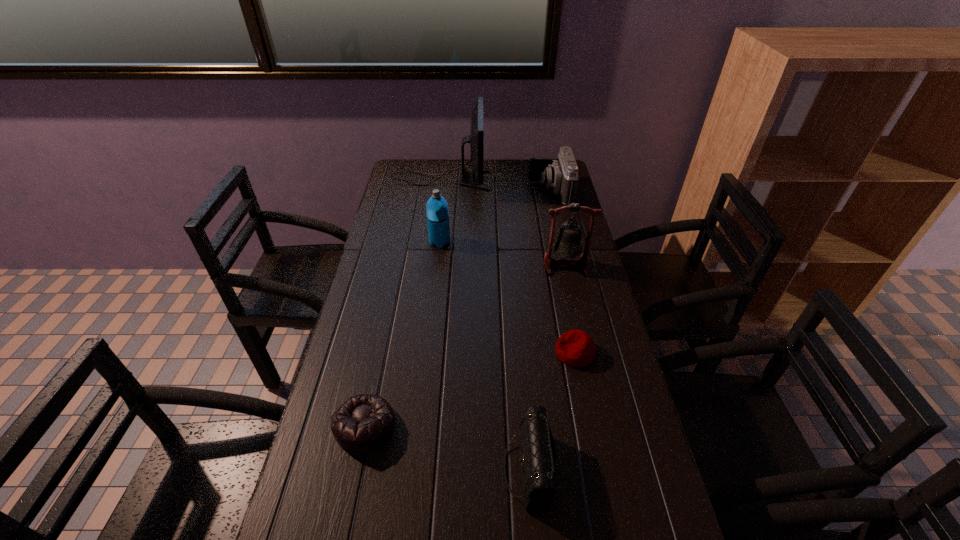
At what (x,y) coordinates should I click in order to perform the action: click on free location located on the screen side of the tallest object. Please return your answer as a coordinate pair (x, y). Looking at the image, I should click on (533, 180).

Where is `vacant area situated on the back of the fourth farthest object`? vacant area situated on the back of the fourth farthest object is located at coordinates (557, 227).

Image resolution: width=960 pixels, height=540 pixels. Find the location of `free location located on the left of the fifth nearest object`. free location located on the left of the fifth nearest object is located at coordinates (x=403, y=242).

Identify the location of free space located 0.170m at the front of the fourth shortest object with an open lens cover. (487, 191).

At what (x,y) coordinates should I click in order to perform the action: click on free space located 0.120m at the front of the fourth shortest object with an open lens cover. Please return your answer as a coordinate pair (x, y). The image size is (960, 540). Looking at the image, I should click on [499, 191].

Find the location of a particular element. This screenshot has width=960, height=540. free location located at the front of the fourth shortest object with an open lens cover is located at coordinates (472, 191).

The image size is (960, 540). Find the location of `vacant space located on the front flap of the fourth object from right to left`. vacant space located on the front flap of the fourth object from right to left is located at coordinates (335, 469).

In order to click on vacant area located on the front flap of the fourth object from right to left in this screenshot , I will do `click(353, 469)`.

I want to click on free space located on the front flap of the fourth object from right to left, so click(462, 469).

This screenshot has height=540, width=960. Identify the location of free space located on the right of the left beanbag. (487, 426).